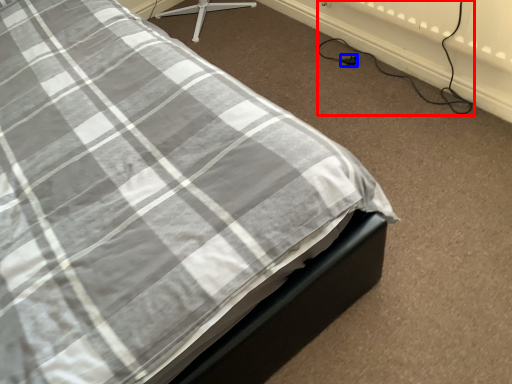
Question: Among these objects, which one is farthest to the camera, cable (highlighted by a red box) or plug (highlighted by a blue box)?

Choices:
 (A) cable
 (B) plug

Answer: (B)